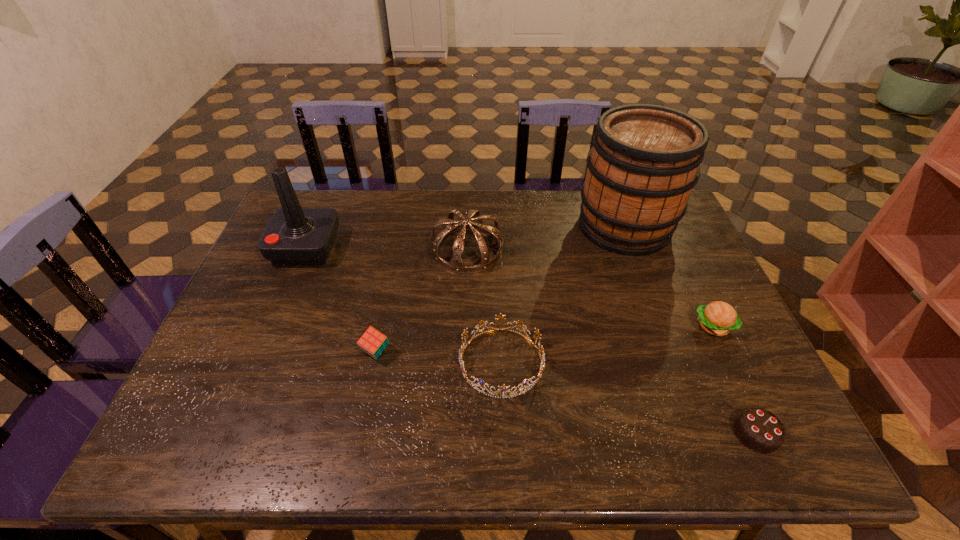
The height and width of the screenshot is (540, 960). I want to click on object that is at the left edge, so click(294, 236).

At what (x,y) coordinates should I click in order to perform the action: click on cider that is at the right edge. Please return your answer as a coordinate pair (x, y). This screenshot has height=540, width=960. Looking at the image, I should click on (644, 162).

Image resolution: width=960 pixels, height=540 pixels. I want to click on hamburger that is positioned at the right edge, so click(718, 318).

Locate an element on the screen. The height and width of the screenshot is (540, 960). chocolate cake that is at the right edge is located at coordinates (759, 430).

Locate an element on the screen. The image size is (960, 540). object at the far left corner is located at coordinates (294, 236).

Where is `object that is at the far right corner`? This screenshot has width=960, height=540. object that is at the far right corner is located at coordinates (644, 162).

You are a GUI agent. You are given a task and a screenshot of the screen. Output one action in this format:
    pyautogui.click(x=<x>, y=<y>)
    Task: Click on the object at the near right corner
    
    Given the screenshot: What is the action you would take?
    pyautogui.click(x=759, y=430)

In order to click on vacant region at the far edge of the desktop in this screenshot , I will do `click(568, 197)`.

I want to click on vacant space at the near edge, so click(241, 453).

The width and height of the screenshot is (960, 540). Find the location of `vacant space at the left edge of the desktop`. vacant space at the left edge of the desktop is located at coordinates (234, 352).